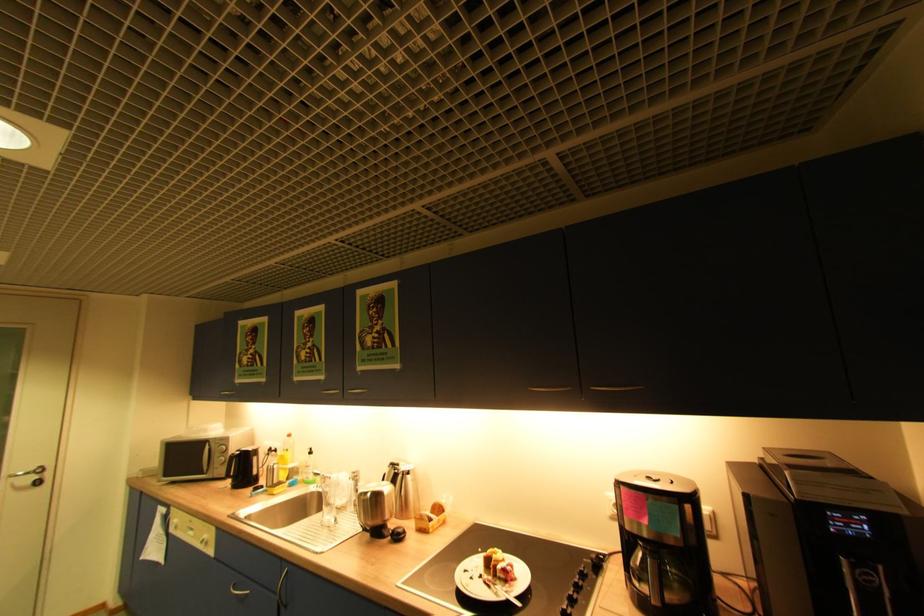
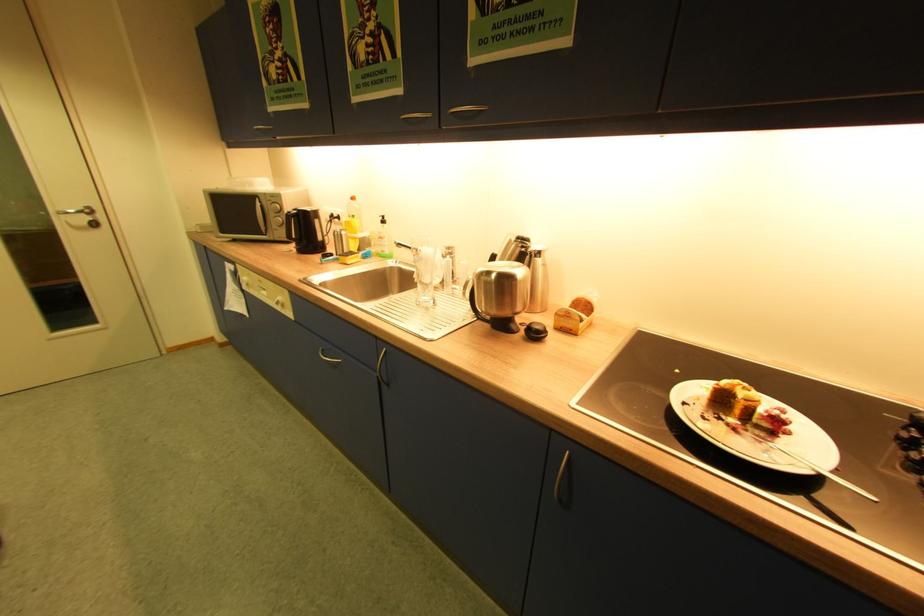
The point at (521, 582) is marked in the first image. Where is the corresponding point in the second image?

(794, 434)